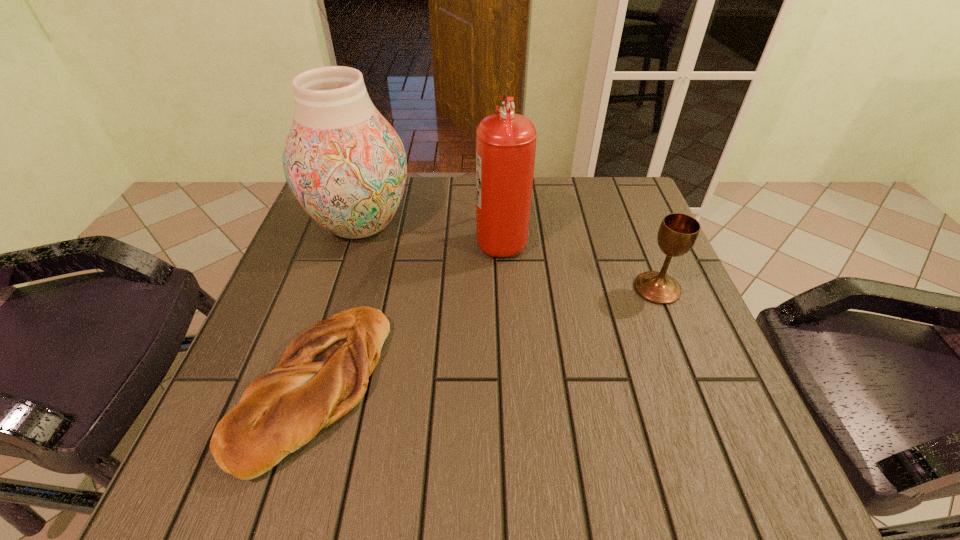
Locate an element on the screen. This screenshot has height=540, width=960. vacant space at the far edge of the desktop is located at coordinates (421, 176).

Locate an element on the screen. This screenshot has height=540, width=960. vacant space at the near edge of the desktop is located at coordinates (641, 450).

Locate an element on the screen. The height and width of the screenshot is (540, 960). free region at the left edge of the desktop is located at coordinates (299, 275).

This screenshot has width=960, height=540. In order to click on free spot at the right edge of the desktop in this screenshot , I will do `click(636, 319)`.

You are a GUI agent. You are given a task and a screenshot of the screen. Output one action in this format:
    pyautogui.click(x=<x>, y=<y>)
    Task: Click on the free space at the near left corner of the desktop
    Image resolution: width=960 pixels, height=540 pixels.
    Given the screenshot: What is the action you would take?
    pyautogui.click(x=277, y=469)

You are a GUI agent. You are given a task and a screenshot of the screen. Output one action in this format:
    pyautogui.click(x=<x>, y=<y>)
    Task: Click on the blank space at the far right corner of the desktop
    This screenshot has height=540, width=960.
    Given the screenshot: What is the action you would take?
    pyautogui.click(x=585, y=179)

In the image, there is a desktop. Identify the location of blank space at the near right corner. This screenshot has width=960, height=540. (713, 478).

Locate an element on the screen. The image size is (960, 540). vacant space that's between the fire extinguisher and the vase is located at coordinates (431, 231).

The height and width of the screenshot is (540, 960). What are the coordinates of `free space between the rightmost object and the third object from left to right` in the screenshot? It's located at (579, 263).

Where is `unoccupied area between the fire extinguisher and the bread`? Image resolution: width=960 pixels, height=540 pixels. unoccupied area between the fire extinguisher and the bread is located at coordinates (408, 312).